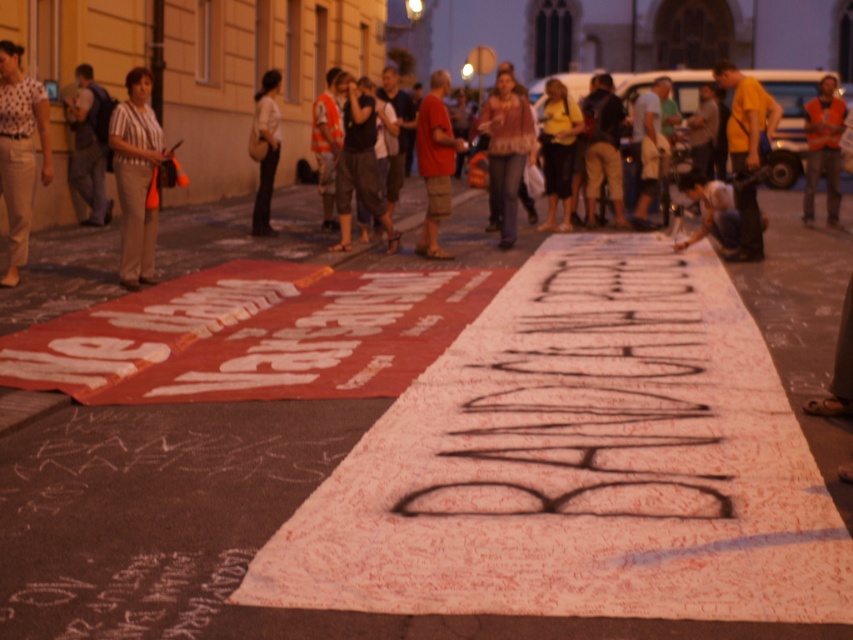
Question: Is yellow t-shirt at center closer to the viewer compared to dark gray backpack at left?

Choices:
 (A) no
 (B) yes

Answer: (B)

Question: Which of the following is the farthest from the observer?

Choices:
 (A) (97, 212)
 (B) (444, 140)
 (C) (403, 616)

Answer: (A)

Question: Which object is closer to the camera taking this photo?

Choices:
 (A) light beige fabric at center
 (B) dark blue jeans at lower right

Answer: (B)

Question: Which object is the closest to the light beige pants at left?

Choices:
 (A) dark blue jeans at lower right
 (B) knitted sweater at center
 (C) yellow jersey at center
 (D) yellow t-shirt at center

Answer: (B)

Question: Can you confirm if dark gray pants at center is wider than matte red t-shirt at center?

Choices:
 (A) yes
 (B) no

Answer: (A)

Question: Is striped fabric shirt at left below dark gray pants at center?

Choices:
 (A) yes
 (B) no

Answer: (A)